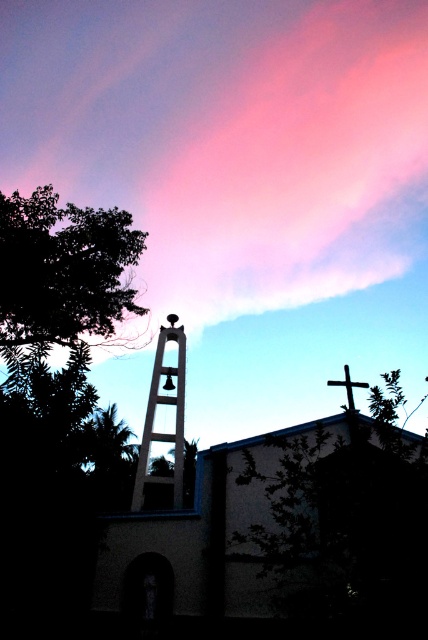
You are standing in the field looking at the dark green leafy tree at left and the metallic bell tower at center. Which object would appear larger to you?

The dark green leafy tree at left appears larger because it is closer to the viewer than the metallic bell tower at center.

You are standing in front of the bell tower and want to take a photo that includes both the bell tower and the church building to the right. Which point, point 1 at coordinates (x=285, y=38) or point 2 at coordinates (x=160, y=477), is closer to you?

Point 1 at coordinates (x=285, y=38) is closer to you because it is further to the camera than point 2 at coordinates (x=160, y=477).